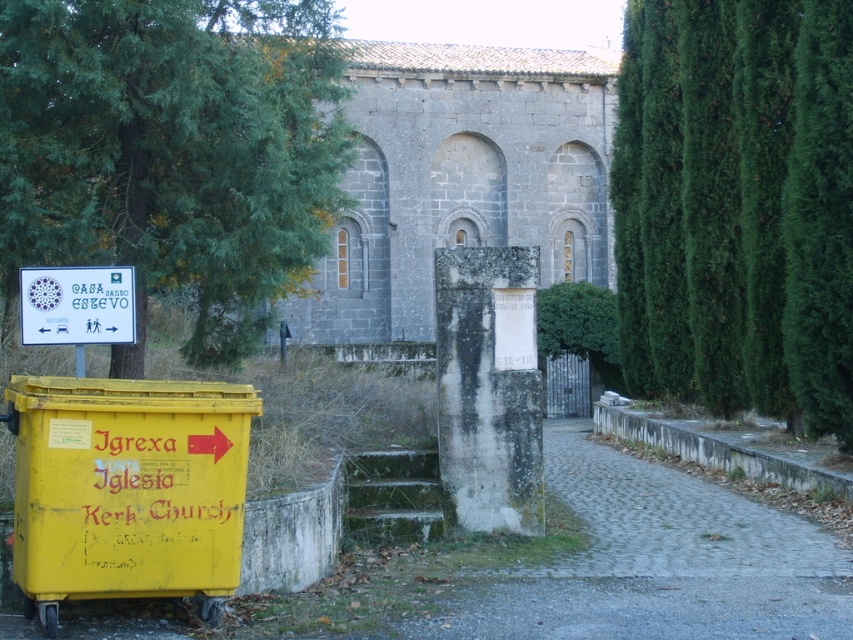
Does green leafy tree at right appear on the left side of gray stone church at center?

No, green leafy tree at right is not to the left of gray stone church at center.

Does green leafy tree at right appear over gray stone church at center?

Actually, green leafy tree at right is below gray stone church at center.

Which is behind, point (701, 330) or point (367, 211)?

Positioned behind is point (367, 211).

Identify the location of green leafy tree at right. (737, 205).

Is point (753, 280) more distant than point (469, 326)?

That is True.

Does green leafy tree at right appear on the right side of white stone pillar at center?

Indeed, green leafy tree at right is positioned on the right side of white stone pillar at center.

Is point (732, 330) farther from camera compared to point (492, 262)?

Yes, it is.

Locate an element on the screen. green leafy tree at right is located at coordinates (737, 205).

Who is shorter, white stone pillar at center or white paper sign at upper left?

With less height is white paper sign at upper left.

Is point (503, 348) less distant than point (105, 330)?

That is False.

Image resolution: width=853 pixels, height=640 pixels. Identify the location of white stone pillar at center. (489, 387).